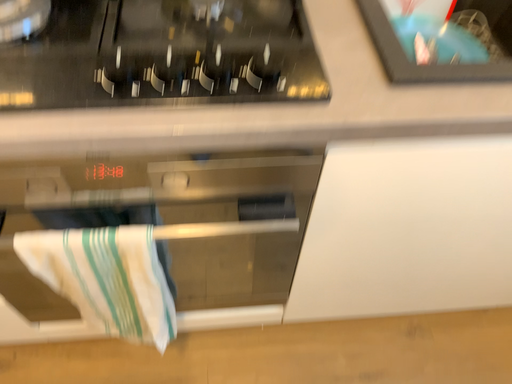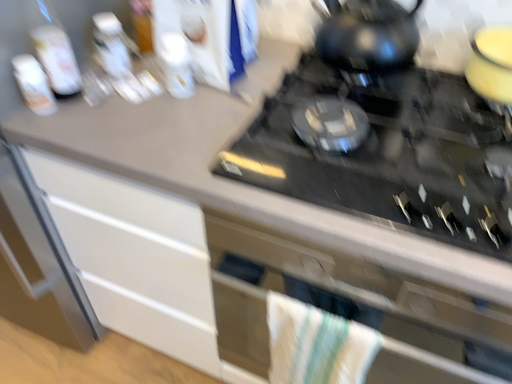
Question: How did the camera likely rotate when shooting the video?

Choices:
 (A) rotated right
 (B) rotated left

Answer: (B)